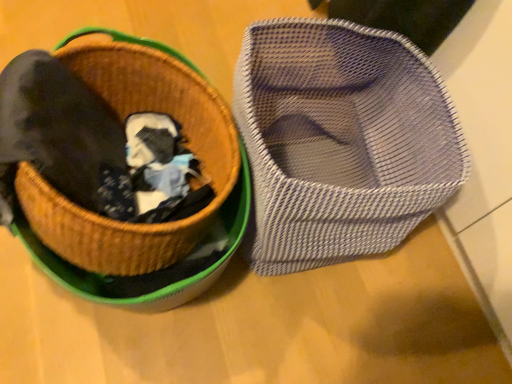
Locate an element on the screen. The width and height of the screenshot is (512, 384). woven straw basket at upper left is located at coordinates (122, 119).

Describe the element at coordinates (122, 119) in the screenshot. I see `woven straw basket at upper left` at that location.

Locate an element on the screen. The height and width of the screenshot is (384, 512). mesh fabric shoe at right is located at coordinates (340, 141).

In order to face mesh fabric shoe at right, should I rotate leftwards or rightwards?

To align with it, rotate right about 10.113°.

Describe the element at coordinates (340, 141) in the screenshot. I see `mesh fabric shoe at right` at that location.

The width and height of the screenshot is (512, 384). Find the location of `woven straw basket at upper left`. woven straw basket at upper left is located at coordinates (122, 119).

Which is more to the right, mesh fabric shoe at right or woven straw basket at upper left?

Positioned to the right is mesh fabric shoe at right.

Consider the image. Relative to woven straw basket at upper left, is mesh fabric shoe at right in front or behind?

mesh fabric shoe at right is behind woven straw basket at upper left.

Does point (388, 228) lie behind point (207, 132)?

That is False.

From the image's perspective, is mesh fabric shoe at right located above woven straw basket at upper left?

No, from the image's perspective, mesh fabric shoe at right is not on top of woven straw basket at upper left.

From a real-world perspective, which object rests below the other?

mesh fabric shoe at right is physically lower.

Considering the sizes of objects mesh fabric shoe at right and woven straw basket at upper left in the image provided, who is wider, mesh fabric shoe at right or woven straw basket at upper left?

woven straw basket at upper left is wider.

Considering the sizes of mesh fabric shoe at right and woven straw basket at upper left in the image, is mesh fabric shoe at right taller or shorter than woven straw basket at upper left?

Clearly, mesh fabric shoe at right is taller compared to woven straw basket at upper left.

Is mesh fabric shoe at right smaller than woven straw basket at upper left?

Indeed, mesh fabric shoe at right has a smaller size compared to woven straw basket at upper left.

Is mesh fabric shoe at right not within woven straw basket at upper left?

Yes, mesh fabric shoe at right is located beyond the bounds of woven straw basket at upper left.

Does mesh fabric shoe at right touch woven straw basket at upper left?

mesh fabric shoe at right is not next to woven straw basket at upper left, and they're not touching.

Is mesh fabric shoe at right looking in the opposite direction of woven straw basket at upper left?

No.

I want to click on footwear below the woven straw basket at upper left (from a real-world perspective), so click(x=340, y=141).

Is woven straw basket at upper left to the left of mesh fabric shoe at right from the viewer's perspective?

Indeed, woven straw basket at upper left is positioned on the left side of mesh fabric shoe at right.

Is woven straw basket at upper left positioned in front of mesh fabric shoe at right?

Yes, it is.

Considering the points (78, 42) and (316, 224), which point is in front, point (78, 42) or point (316, 224)?

Point (316, 224)

From the image's perspective, is woven straw basket at upper left below mesh fabric shoe at right?

No.

From a real-world perspective, is woven straw basket at upper left physically above mesh fabric shoe at right?

Yes, from a real-world perspective, woven straw basket at upper left is on top of mesh fabric shoe at right.

Considering the relative sizes of woven straw basket at upper left and mesh fabric shoe at right in the image provided, is woven straw basket at upper left thinner than mesh fabric shoe at right?

No.

Between woven straw basket at upper left and mesh fabric shoe at right, which one has less height?

Standing shorter between the two is woven straw basket at upper left.

In terms of size, does woven straw basket at upper left appear bigger or smaller than mesh fabric shoe at right?

Considering their sizes, woven straw basket at upper left takes up more space than mesh fabric shoe at right.

Can mesh fabric shoe at right be found inside woven straw basket at upper left?

No, mesh fabric shoe at right is not inside woven straw basket at upper left.

Is there a large distance between woven straw basket at upper left and mesh fabric shoe at right?

No, woven straw basket at upper left is not far away from mesh fabric shoe at right.

Is woven straw basket at upper left oriented away from mesh fabric shoe at right?

Absolutely, woven straw basket at upper left is directed away from mesh fabric shoe at right.

How many degrees apart are the facing directions of woven straw basket at upper left and mesh fabric shoe at right?

woven straw basket at upper left and mesh fabric shoe at right are facing 9.99 degrees away from each other.

I want to click on basket above the mesh fabric shoe at right (from the image's perspective), so click(122, 119).

In the image, there is a mesh fabric shoe at right. In order to click on basket above it (from the image's perspective) in this screenshot , I will do `click(122, 119)`.

Find the location of a particular element. The height and width of the screenshot is (384, 512). basket that is on the left side of mesh fabric shoe at right is located at coordinates (122, 119).